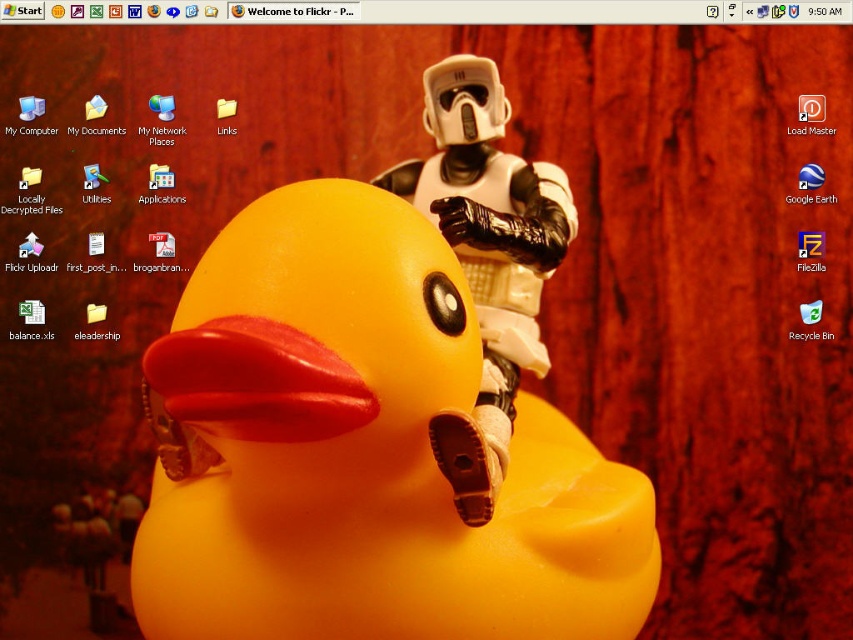
Does rubber yellow duck at center appear on the right side of white matte stormtrooper helmet at center?

In fact, rubber yellow duck at center is to the left of white matte stormtrooper helmet at center.

Can you confirm if rubber yellow duck at center is bigger than white matte stormtrooper helmet at center?

Yes, rubber yellow duck at center is bigger than white matte stormtrooper helmet at center.

Identify the location of rubber yellow duck at center. (361, 451).